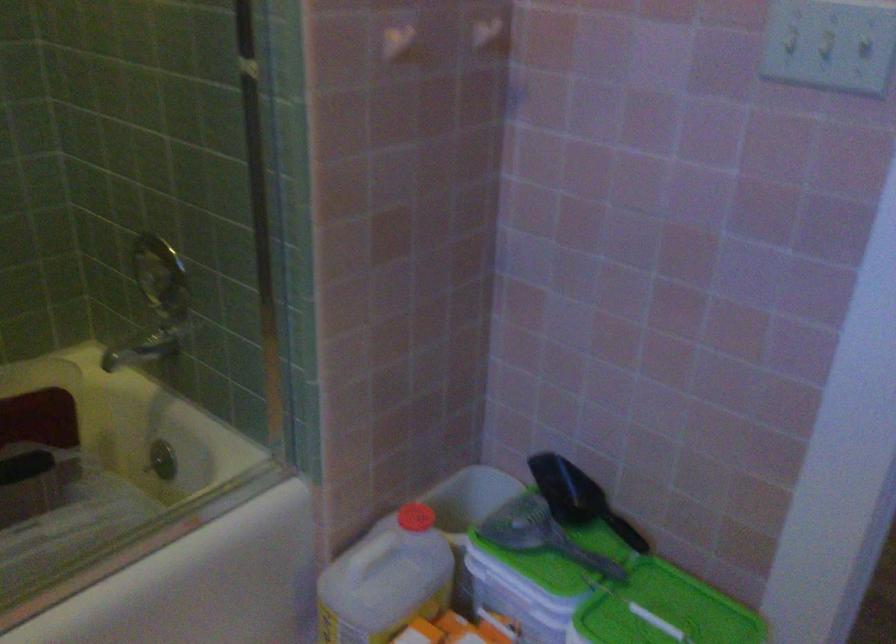
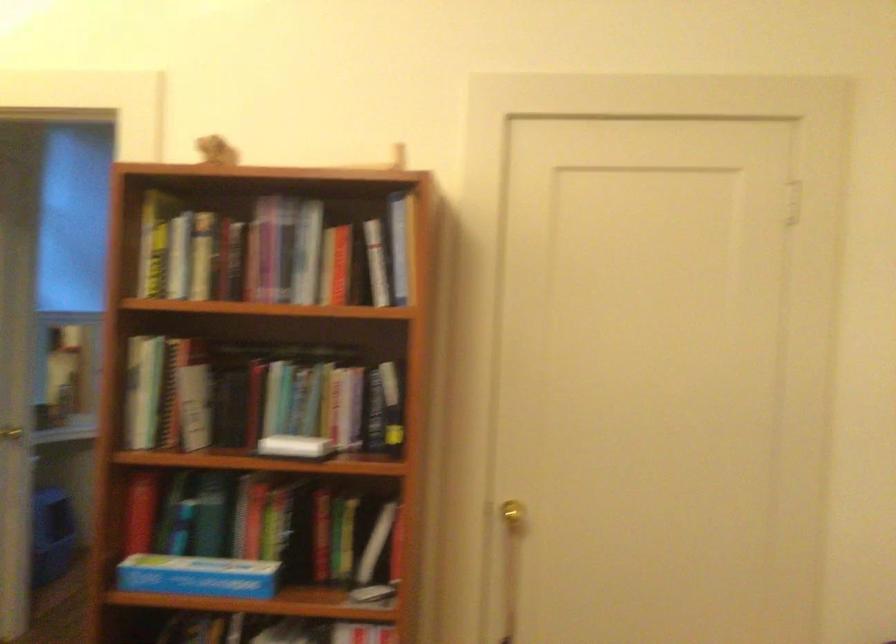
Question: I am providing you with two images of the same scene from different viewpoints. Which of the following objects are not visible in image2?

Choices:
 (A) small brown figurine
 (B) silver door knob
 (C) black scoop handle
 (D) rice cooker lid button

Answer: (C)